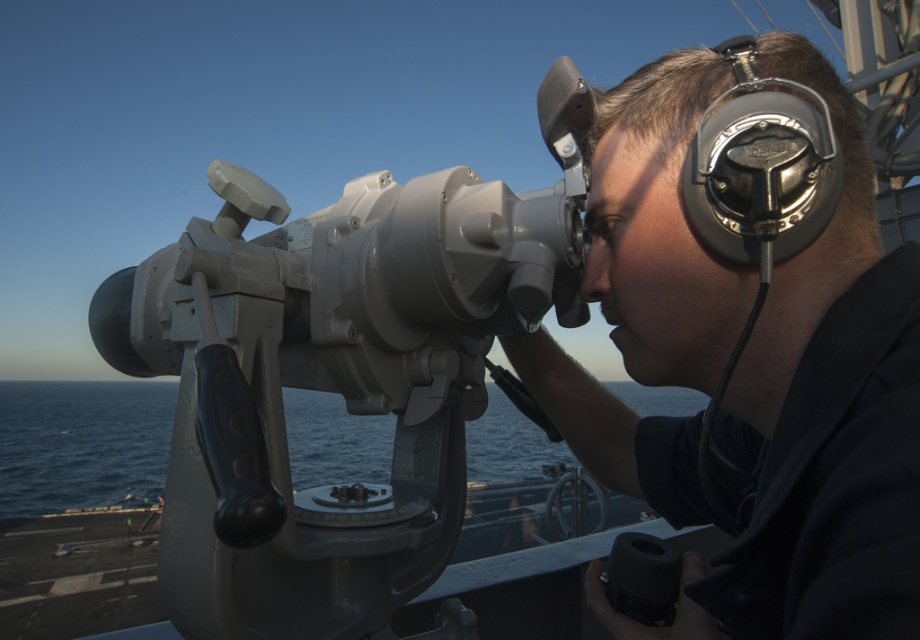
Looking at this image, you are a crew member on a naval ship and need to adjust the metallic gray binoculars at center for a better view. The ship is rocking slightly due to waves. Considering the binoculars are 13.33 inches away from the camera, can you safely reach them without overextending your arm?

The metallic gray binoculars at center are 13.33 inches away from the camera, so yes, you can safely reach them without overextending your arm as this distance is within a comfortable reach for most people.

You are on a ship deck and need to observe something in the distance. You have the metallic gray binoculars at center and the blue water at lower left. Which object should you use to see the distant ship?

You should use the metallic gray binoculars at center to see the distant ship because the blue water at lower left is behind the binoculars and not an observation tool.